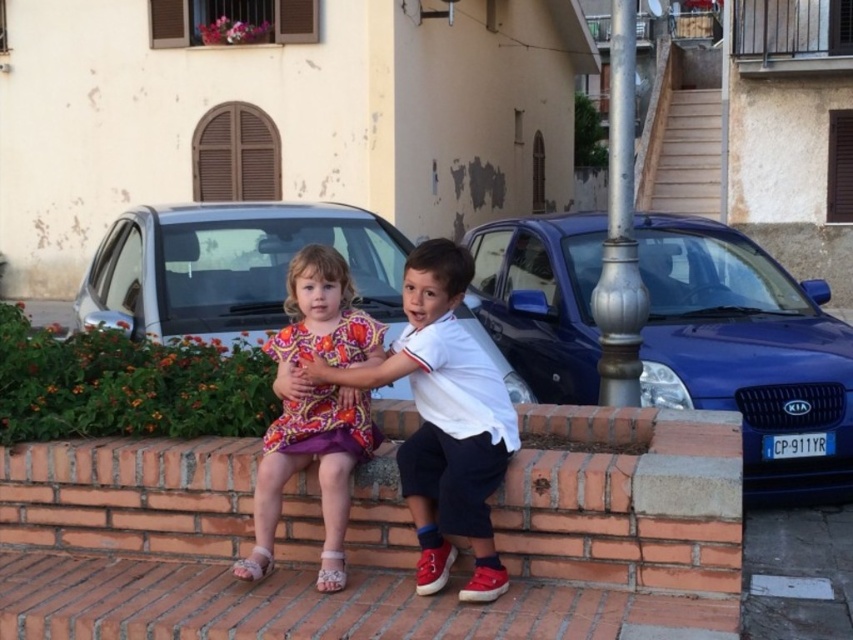
Question: Does brick at lower center have a smaller size compared to blue metallic car at right?

Choices:
 (A) yes
 (B) no

Answer: (A)

Question: Estimate the real-world distances between objects in this image. Which object is closer to the blue metallic car at right?

Choices:
 (A) printed fabric dress at center
 (B) white cotton shirt at center
 (C) silver metallic car at center
 (D) brick at lower center

Answer: (C)

Question: Among these points, which one is nearest to the camera?

Choices:
 (A) (218, 241)
 (B) (828, 358)
 (C) (352, 438)
 (D) (646, 554)

Answer: (D)

Question: Is brick at lower center to the right of blue metallic car at right from the viewer's perspective?

Choices:
 (A) yes
 (B) no

Answer: (B)

Question: Estimate the real-world distances between objects in this image. Which object is farther from the printed fabric dress at center?

Choices:
 (A) silver metallic car at center
 (B) blue metallic car at right

Answer: (B)

Question: Does blue metallic car at right have a lesser width compared to silver metallic car at center?

Choices:
 (A) yes
 (B) no

Answer: (A)